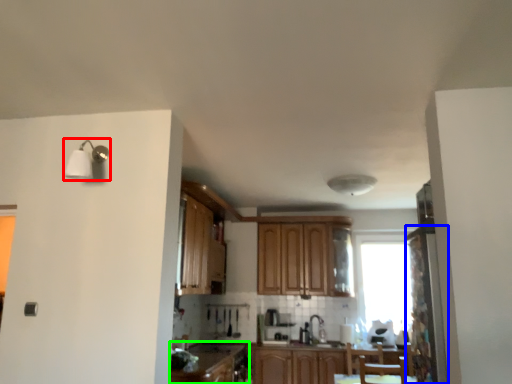
Question: Which object is the farthest from light fixture (highlighted by a red box)? Choose among these: screen door (highlighted by a blue box) or cabinetry (highlighted by a green box).

Choices:
 (A) screen door
 (B) cabinetry

Answer: (A)